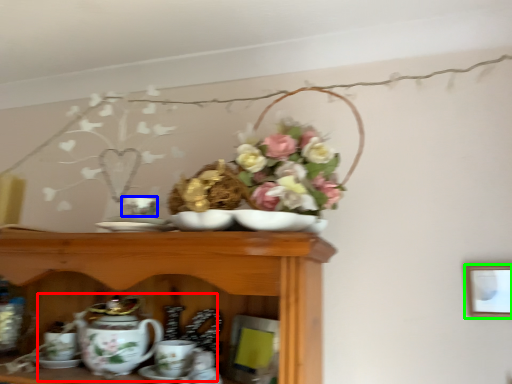
Question: Which is nearer to the tea set (highlighted by a red box)? tableware (highlighted by a blue box) or picture frame (highlighted by a green box).

Choices:
 (A) tableware
 (B) picture frame

Answer: (A)